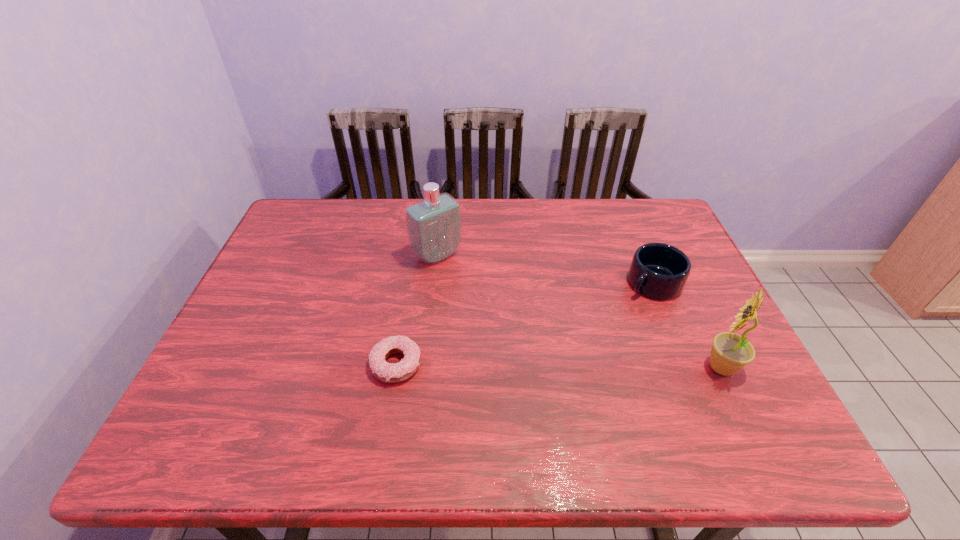
Where is `vacant point that satisfies the following two spatial constraints: 1. on the back side of the doughnut; 2. on the left side of the perfume`? This screenshot has height=540, width=960. vacant point that satisfies the following two spatial constraints: 1. on the back side of the doughnut; 2. on the left side of the perfume is located at coordinates (414, 255).